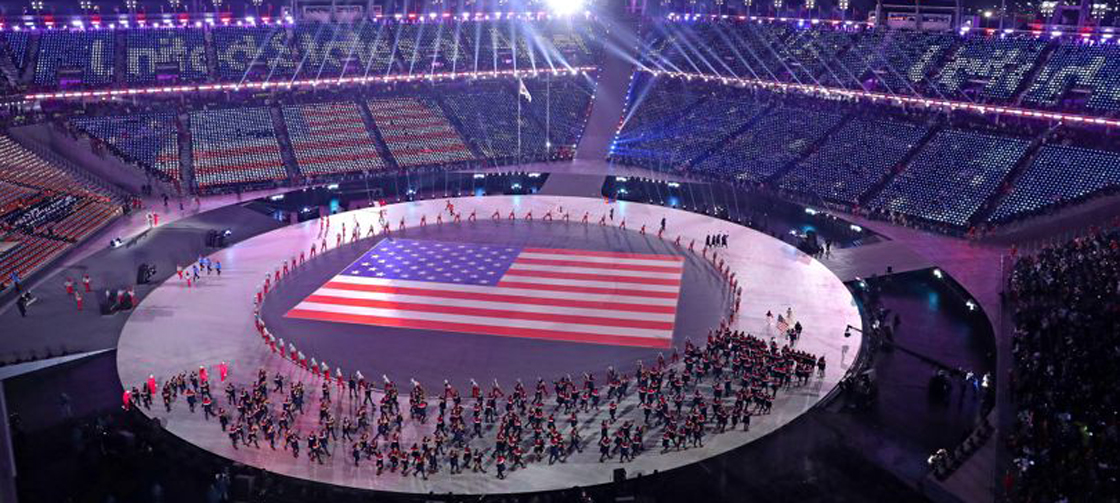
Identify the location of bright spotlight glow. The width and height of the screenshot is (1120, 503). (560, 8).